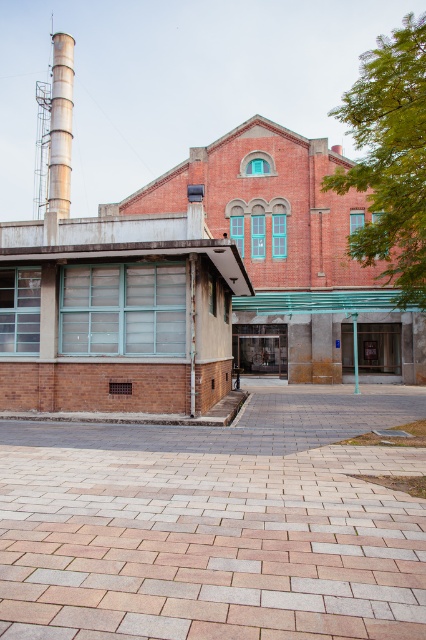
Question: Which point is closer to the camera?

Choices:
 (A) (356, 348)
 (B) (31, 461)

Answer: (B)

Question: Can you confirm if pebble stone pavement at center is positioned to the right of red brick building at center?

Choices:
 (A) no
 (B) yes

Answer: (A)

Question: Which object appears farthest from the camera in this image?

Choices:
 (A) pebble stone pavement at center
 (B) brushed metal pipe at upper left
 (C) green painted concrete pillar at center
 (D) red brick building at center

Answer: (C)

Question: Does red brick building at center have a greater width compared to green painted concrete pillar at center?

Choices:
 (A) yes
 (B) no

Answer: (A)

Question: Which object is the farthest from the red brick building at center?

Choices:
 (A) green painted concrete pillar at center
 (B) pebble stone pavement at center
 (C) brushed metal pipe at upper left

Answer: (B)

Question: Is pebble stone pavement at center bigger than red brick building at center?

Choices:
 (A) no
 (B) yes

Answer: (A)